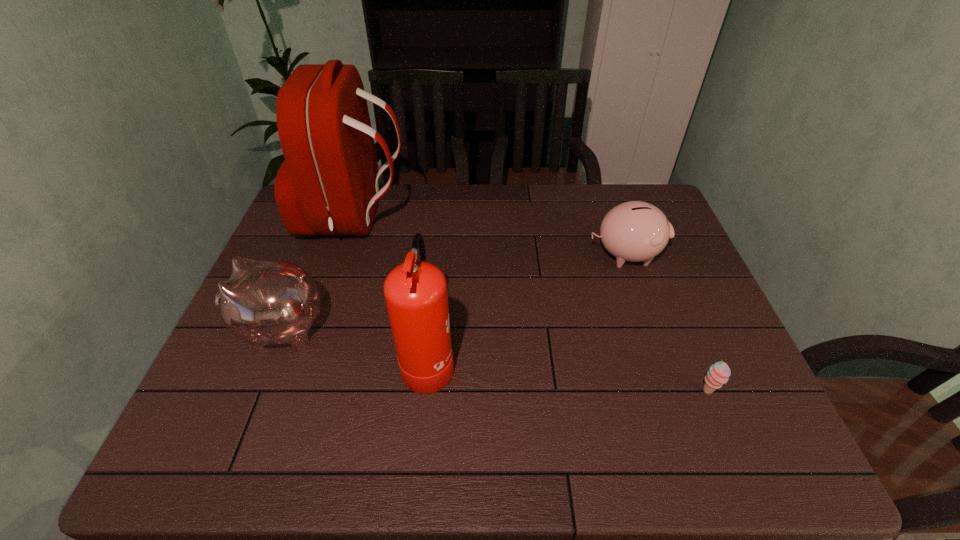
Identify the location of vacant space located 0.350m on the front of the right piggy bank. tap(670, 386).

Where is `free location located 0.210m on the left of the sherbert`? This screenshot has width=960, height=540. free location located 0.210m on the left of the sherbert is located at coordinates (604, 392).

What are the coordinates of `object located at the far edge` in the screenshot? It's located at (328, 185).

Where is `backpack at the left edge`? backpack at the left edge is located at coordinates tap(328, 185).

Image resolution: width=960 pixels, height=540 pixels. What are the coordinates of `piggy bank that is at the left edge` in the screenshot? It's located at (264, 302).

Image resolution: width=960 pixels, height=540 pixels. I want to click on piggy bank at the right edge, so click(x=634, y=231).

Identify the location of sherbert positioned at the right edge. (718, 374).

Image resolution: width=960 pixels, height=540 pixels. Find the location of `object situated at the far left corner`. object situated at the far left corner is located at coordinates (328, 185).

You are a GUI agent. You are given a task and a screenshot of the screen. Output one action in this format:
    pyautogui.click(x=<x>, y=<y>)
    Task: Click on the vacant area at the far edge of the desktop
    The width and height of the screenshot is (960, 540).
    Given the screenshot: What is the action you would take?
    pyautogui.click(x=454, y=210)

The width and height of the screenshot is (960, 540). I want to click on vacant region at the near edge of the desktop, so click(604, 452).